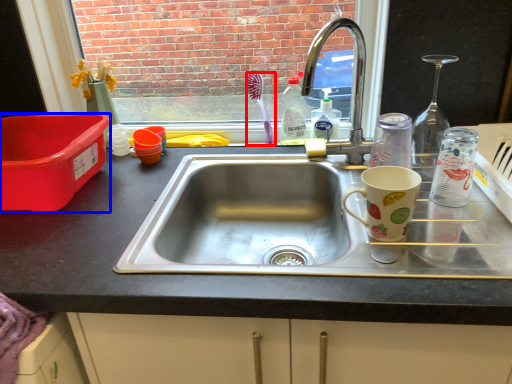
Question: Which object appears closest to the camera in this image, toothbrush (highlighted by a red box) or box (highlighted by a blue box)?

Choices:
 (A) toothbrush
 (B) box

Answer: (B)